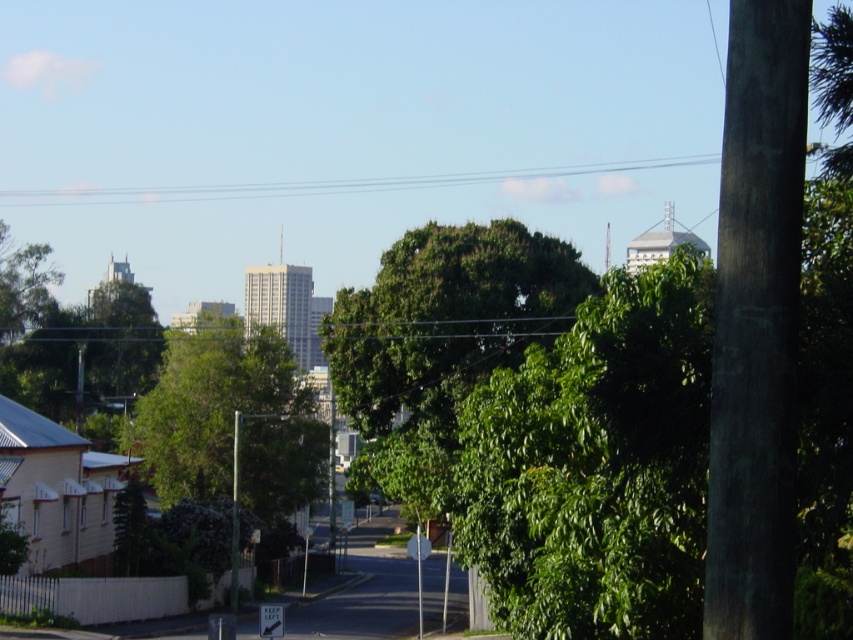
Question: Which object is farther from the camera taking this photo?

Choices:
 (A) metallic pole at center
 (B) green leafy tree at center

Answer: (B)

Question: Which is nearer to the metallic pole at center?

Choices:
 (A) white plastic street sign at lower center
 (B) green leafy tree at center
 (C) dark brown wood pole at right

Answer: (B)

Question: Can you confirm if dark brown wood pole at right is bigger than white plastic street sign at lower center?

Choices:
 (A) yes
 (B) no

Answer: (A)

Question: Is dark brown wood pole at right further to camera compared to green leafy tree at center?

Choices:
 (A) yes
 (B) no

Answer: (B)

Question: Is green leafy tree at center positioned in front of metallic pole at center?

Choices:
 (A) no
 (B) yes

Answer: (A)

Question: Which point appears farthest from the camera in this image?

Choices:
 (A) (235, 424)
 (B) (753, 10)
 (C) (270, 608)
 (D) (202, 360)

Answer: (D)